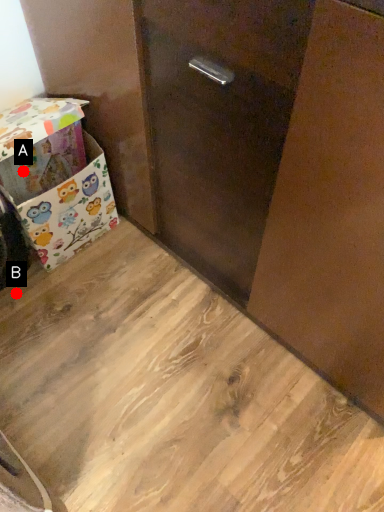
Question: Two points are circled on the image, labeled by A and B beside each circle. Which point is closer to the camera taking this photo?

Choices:
 (A) A is closer
 (B) B is closer

Answer: (A)